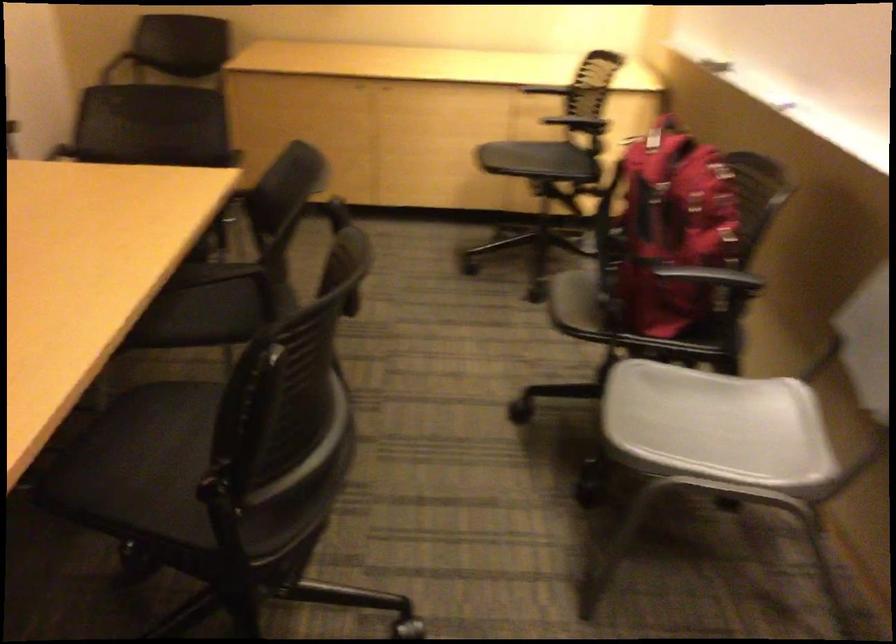
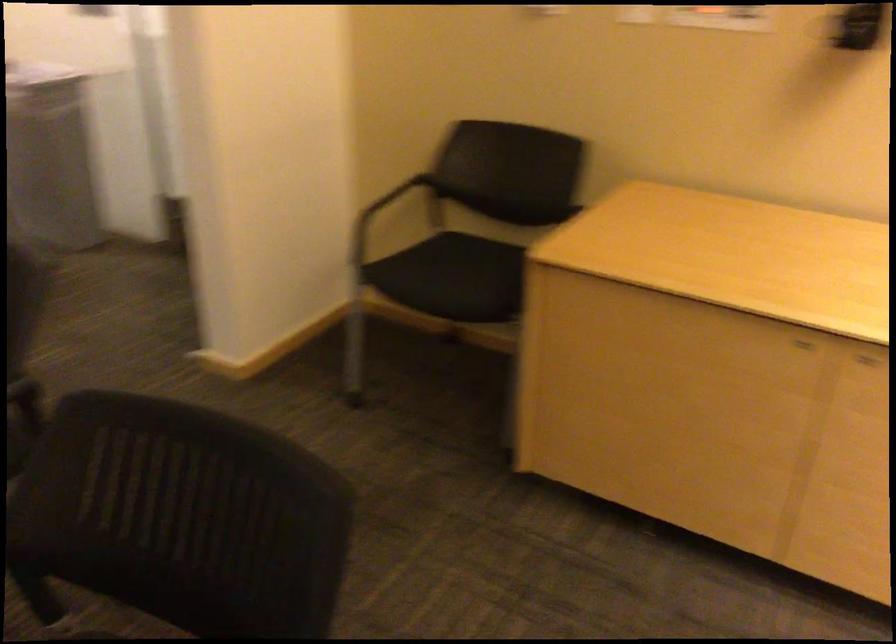
In the second image, find the point that corresponds to the point at 99,67 in the first image.

(412, 196)